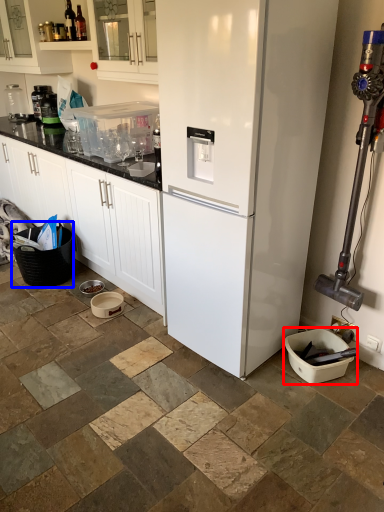
Question: Which of the following is the closest to the observer, appliance (highlighted by a red box) or basket (highlighted by a blue box)?

Choices:
 (A) appliance
 (B) basket

Answer: (A)